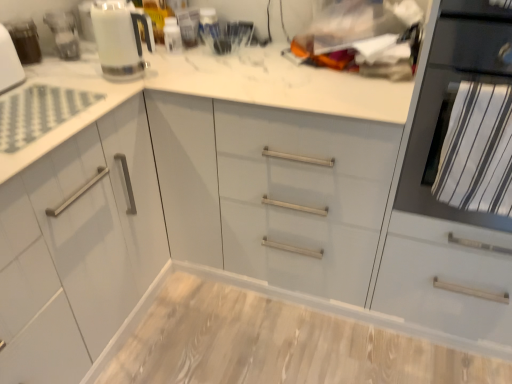
Question: From a real-world perspective, is white glossy kettle at upper left positioned above or below wooden at center?

Choices:
 (A) below
 (B) above

Answer: (B)

Question: Considering the positions of white glossy kettle at upper left and wooden at center in the image, is white glossy kettle at upper left wider or thinner than wooden at center?

Choices:
 (A) thin
 (B) wide

Answer: (A)

Question: Estimate the real-world distances between objects in this image. Which object is farther from the wooden at center?

Choices:
 (A) white glossy kettle at upper left
 (B) matte white kettle at upper left
 (C) black matte oven at right

Answer: (B)

Question: Estimate the real-world distances between objects in this image. Which object is farther from the black matte oven at right?

Choices:
 (A) wooden at center
 (B) matte white kettle at upper left
 (C) white glossy kettle at upper left

Answer: (B)